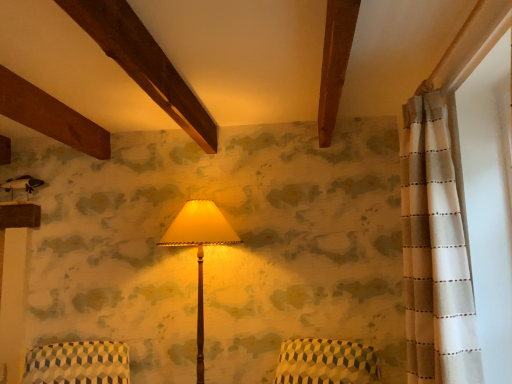
The width and height of the screenshot is (512, 384). What do you see at coordinates (78, 363) in the screenshot? I see `patterned fabric armchair at lower left` at bounding box center [78, 363].

The width and height of the screenshot is (512, 384). What are the coordinates of `white dotted fabric at right` in the screenshot? It's located at (487, 199).

Who is bigger, patterned fabric armchair at lower left or wooden floor lamp at center?

wooden floor lamp at center is bigger.

From the image's perspective, which is below, patterned fabric armchair at lower left or wooden floor lamp at center?

patterned fabric armchair at lower left is shown below in the image.

Are patterned fabric armchair at lower left and wooden floor lamp at center making contact?

patterned fabric armchair at lower left is not next to wooden floor lamp at center, and they're not touching.

Who is taller, patterned fabric armchair at lower left or wooden floor lamp at center?

wooden floor lamp at center.

Is patterned fabric armchair at lower left aimed at white dotted fabric at right?

No, patterned fabric armchair at lower left is not facing towards white dotted fabric at right.

Where is `armchair located behind the white dotted fabric at right`? The height and width of the screenshot is (384, 512). armchair located behind the white dotted fabric at right is located at coordinates (78, 363).

Looking at this image, how many degrees apart are the facing directions of patterned fabric armchair at lower left and white dotted fabric at right?

The angle between the facing direction of patterned fabric armchair at lower left and the facing direction of white dotted fabric at right is 111 degrees.

Considering the sizes of objects patterned fabric armchair at lower left and white dotted fabric at right in the image provided, who is thinner, patterned fabric armchair at lower left or white dotted fabric at right?

white dotted fabric at right.

How many degrees apart are the facing directions of white dotted fabric at right and patterned fabric armchair at lower left?

white dotted fabric at right and patterned fabric armchair at lower left are facing 111 degrees away from each other.

Is the depth of white dotted fabric at right greater than that of patterned fabric armchair at lower left?

No.

Do you think white dotted fabric at right is within patterned fabric armchair at lower left, or outside of it?

white dotted fabric at right exists outside the volume of patterned fabric armchair at lower left.

Which of these two, white dotted fabric at right or patterned fabric armchair at lower left, is thinner?

white dotted fabric at right is thinner.

Based on their sizes in the image, would you say wooden floor lamp at center is bigger or smaller than white dotted fabric at right?

Clearly, wooden floor lamp at center is larger in size than white dotted fabric at right.

From the image's perspective, is wooden floor lamp at center positioned above or below white dotted fabric at right?

Based on their image positions, wooden floor lamp at center is located beneath white dotted fabric at right.

Which is more to the right, wooden floor lamp at center or white dotted fabric at right?

Positioned to the right is white dotted fabric at right.

Is point (177, 241) positioned behind point (487, 382)?

Yes, it is behind point (487, 382).

Is wooden floor lamp at center completely or partially inside white dotted fabric at right?

No, white dotted fabric at right does not contain wooden floor lamp at center.

Is white dotted fabric at right looking in the opposite direction of wooden floor lamp at center?

That's not correct — white dotted fabric at right is not looking away from wooden floor lamp at center.

Find the location of a particular element. This screenshot has width=512, height=384. window screen located on the right of wooden floor lamp at center is located at coordinates (487, 199).

Does point (495, 80) lie behind point (167, 245)?

No, it is not.

From the picture: Which of these two, wooden floor lamp at center or patterned fabric armchair at lower left, is thinner?

wooden floor lamp at center is thinner.

Is point (202, 357) in front of point (86, 341)?

That is True.

Does wooden floor lamp at center touch patterned fabric armchair at lower left?

No.

At what (x,y) coordinates should I click in order to perform the action: click on lamp behind the patterned fabric armchair at lower left. Please return your answer as a coordinate pair (x, y). This screenshot has width=512, height=384. Looking at the image, I should click on (200, 250).

Where is `window screen in front of the patterned fabric armchair at lower left`? The height and width of the screenshot is (384, 512). window screen in front of the patterned fabric armchair at lower left is located at coordinates (487, 199).

Based on their spatial positions, is wooden floor lamp at center or white dotted fabric at right further from patterned fabric armchair at lower left?

white dotted fabric at right is further to patterned fabric armchair at lower left.

Based on their spatial positions, is white dotted fabric at right or patterned fabric armchair at lower left closer to wooden floor lamp at center?

patterned fabric armchair at lower left lies closer to wooden floor lamp at center than the other object.

Considering their positions, is white dotted fabric at right positioned further to patterned fabric armchair at lower left than wooden floor lamp at center?

white dotted fabric at right is further to patterned fabric armchair at lower left.

Which object lies nearer to the anchor point white dotted fabric at right, patterned fabric armchair at lower left or wooden floor lamp at center?

wooden floor lamp at center is closer to white dotted fabric at right.

From the image, which object appears to be farther from white dotted fabric at right, wooden floor lamp at center or patterned fabric armchair at lower left?

The object further to white dotted fabric at right is patterned fabric armchair at lower left.

Considering their positions, is patterned fabric armchair at lower left positioned further to wooden floor lamp at center than white dotted fabric at right?

white dotted fabric at right.

Where is `lamp between patterned fabric armchair at lower left and white dotted fabric at right`? The height and width of the screenshot is (384, 512). lamp between patterned fabric armchair at lower left and white dotted fabric at right is located at coordinates (200, 250).